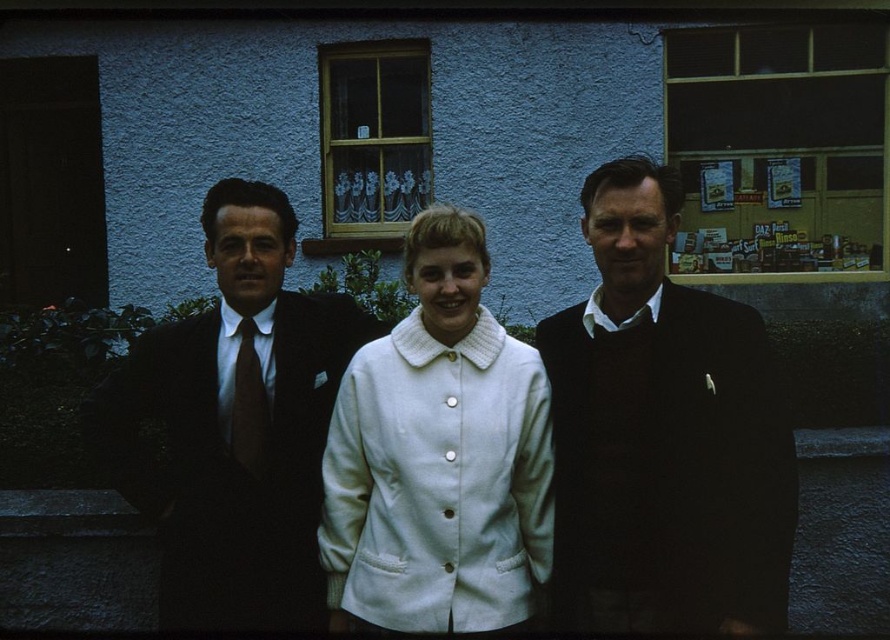
You are a fashion designer observing three people outside a blue wall building. You notice the white wool coat at center and the dark brown sweater at center. Which clothing item is positioned lower on the person?

The white wool coat at center is located below dark brown sweater at center, so the white wool coat at center is positioned lower.

In the scene shown: You are standing 10 feet away from the camera. You want to take a photo of the dark brown sweater at center without moving the camera. Is the sweater within your camera lens range if the camera has a minimum focusing distance of 8 feet?

The dark brown sweater at center is 8.57 feet away from the camera. Since the minimum focusing distance is 8 feet, the sweater is within the camera lens range and can be focused properly.